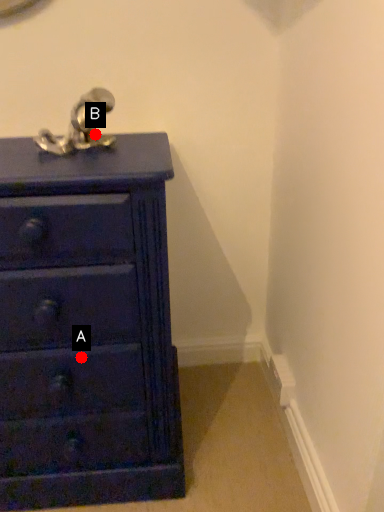
Question: Two points are circled on the image, labeled by A and B beside each circle. Which point appears closest to the camera in this image?

Choices:
 (A) A is closer
 (B) B is closer

Answer: (A)